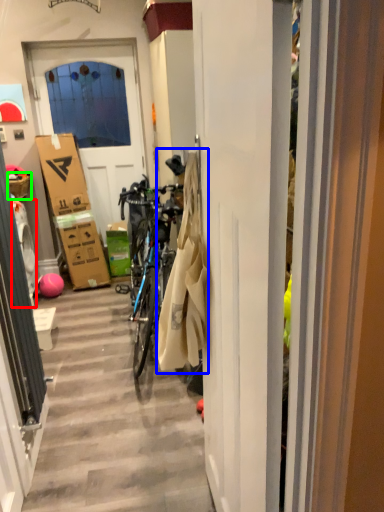
Question: Considering the real-world distances, which object is closest to washing machine (highlighted by a red box)? laundry (highlighted by a blue box) or picnic basket (highlighted by a green box).

Choices:
 (A) laundry
 (B) picnic basket

Answer: (B)